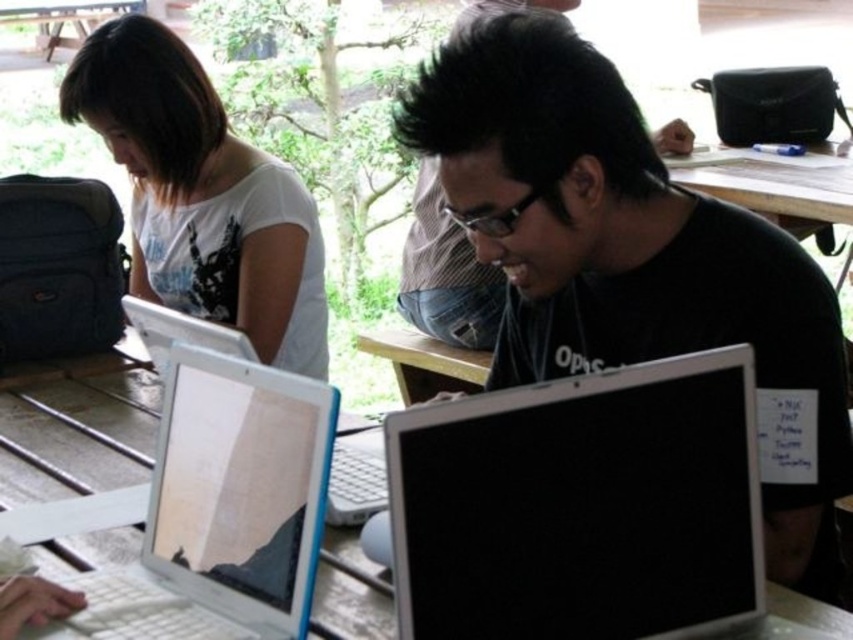
You are a photographer trying to capture a clear shot of the black matte laptop at center and the white matte shirt at upper left. Since the laptop screen is reflecting sunlight, which object should you adjust your camera angle to focus on first to avoid glare?

The black matte laptop at center is much taller than the white matte shirt at upper left, so focusing on the laptop first would help avoid glare from its screen.

You are organizing a tech fair and need to place two laptops on a narrow table. The black matte laptop at center and the black glossy laptop at center. Given their sizes, which one would you choose to ensure it fits better on the table?

The black glossy laptop at center has a smaller width compared to the black matte laptop at center, so it would fit better on the narrow table.